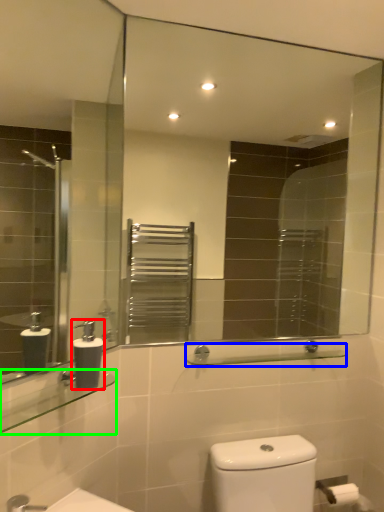
Question: Based on their relative distances, which object is nearer to soap dispenser (highlighted by a red box)? Choose from balustrade (highlighted by a blue box) and balustrade (highlighted by a green box).

Choices:
 (A) balustrade
 (B) balustrade

Answer: (B)